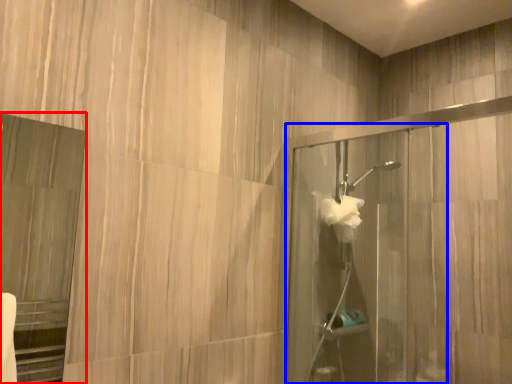
Question: Which point is closer to the camera, screen door (highlighted by a red box) or screen door (highlighted by a blue box)?

Choices:
 (A) screen door
 (B) screen door

Answer: (A)